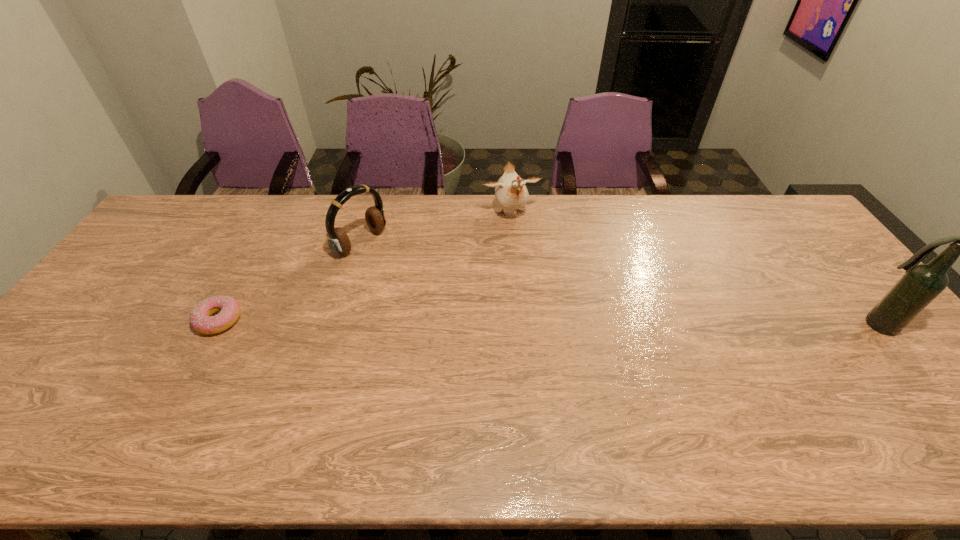
Find the location of a particular element. This screenshot has width=960, height=540. doughnut is located at coordinates (201, 319).

Find the location of a particular element. the leftmost object is located at coordinates (201, 319).

What are the coordinates of `the rightmost object` in the screenshot? It's located at (921, 284).

At what (x,y) coordinates should I click in order to perform the action: click on the tallest object. Please return your answer as a coordinate pair (x, y). Looking at the image, I should click on (921, 284).

Identify the location of the second object from left to right. (x=338, y=241).

Find the location of a particular element. The width and height of the screenshot is (960, 540). bird is located at coordinates (511, 193).

Find the location of a particular element. free space located on the right of the leftmost object is located at coordinates (298, 320).

You are a GUI agent. You are given a task and a screenshot of the screen. Output one action in this format:
    pyautogui.click(x=<x>, y=<y>)
    Task: Click on the vacant space located on the left of the beer bottle
    
    Given the screenshot: What is the action you would take?
    pyautogui.click(x=790, y=325)

In order to click on vacant position located on the ear cup of the headset in this screenshot , I will do `click(466, 309)`.

Find the location of a particular element. Image resolution: width=960 pixels, height=540 pixels. blank area located 0.120m on the ear cup of the headset is located at coordinates (405, 272).